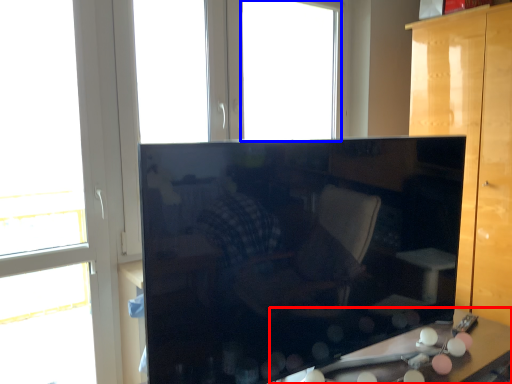
Question: Among these objects, which one is nearest to the camera, table (highlighted by a red box) or window (highlighted by a blue box)?

Choices:
 (A) table
 (B) window

Answer: (A)